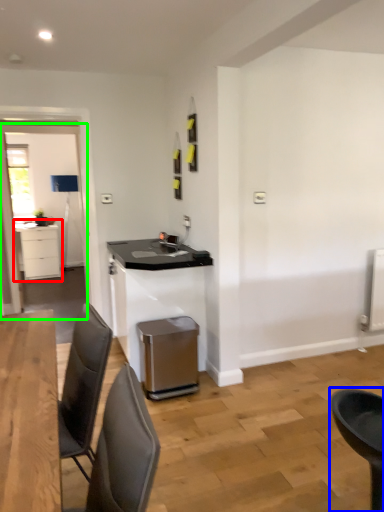
Question: Based on their relative distances, which object is farther from cabinetry (highlighted by a red box)? Choose from chair (highlighted by a blue box) and glass door (highlighted by a green box).

Choices:
 (A) chair
 (B) glass door

Answer: (A)